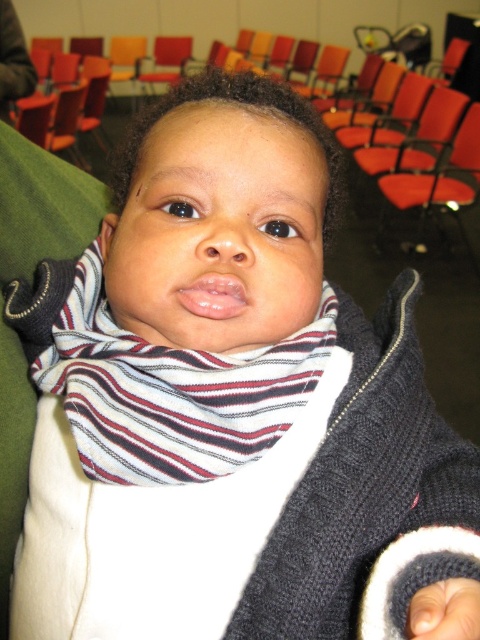
Question: Does white striped scarf at center have a smaller size compared to orange fabric chair at right?

Choices:
 (A) no
 (B) yes

Answer: (B)

Question: Which point is closer to the camera?

Choices:
 (A) (396, 179)
 (B) (143, 396)

Answer: (B)

Question: Can you confirm if white striped scarf at center is smaller than orange fabric chair at right?

Choices:
 (A) no
 (B) yes

Answer: (B)

Question: Which point is closer to the camera taking this photo?

Choices:
 (A) (392, 198)
 (B) (110, 419)

Answer: (B)

Question: Does white striped scarf at center have a lesser width compared to orange fabric chair at right?

Choices:
 (A) no
 (B) yes

Answer: (B)